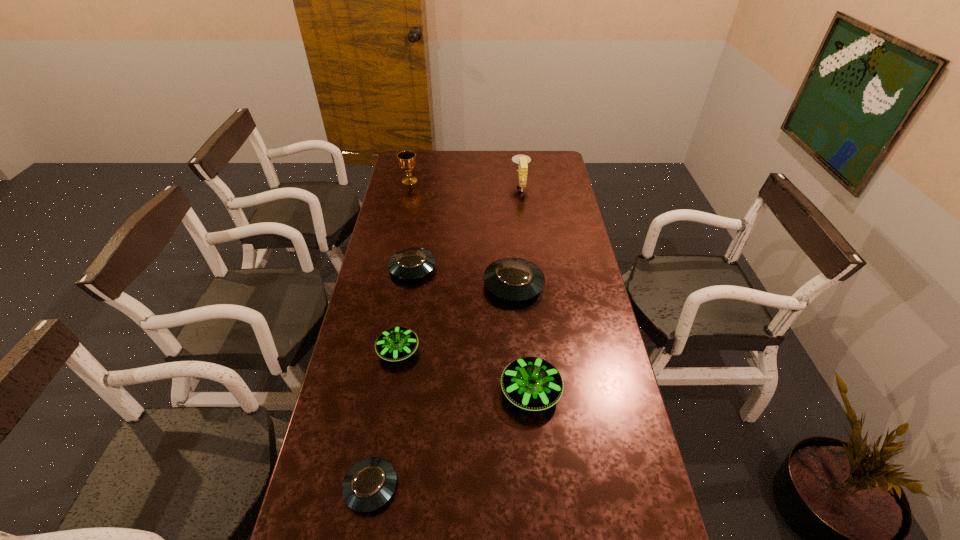
The height and width of the screenshot is (540, 960). Find the location of `vacant region that satisfies the following two spatial constraints: 1. on the back side of the rightmost gray saucer; 2. on the right side of the shortest object`. vacant region that satisfies the following two spatial constraints: 1. on the back side of the rightmost gray saucer; 2. on the right side of the shortest object is located at coordinates (405, 285).